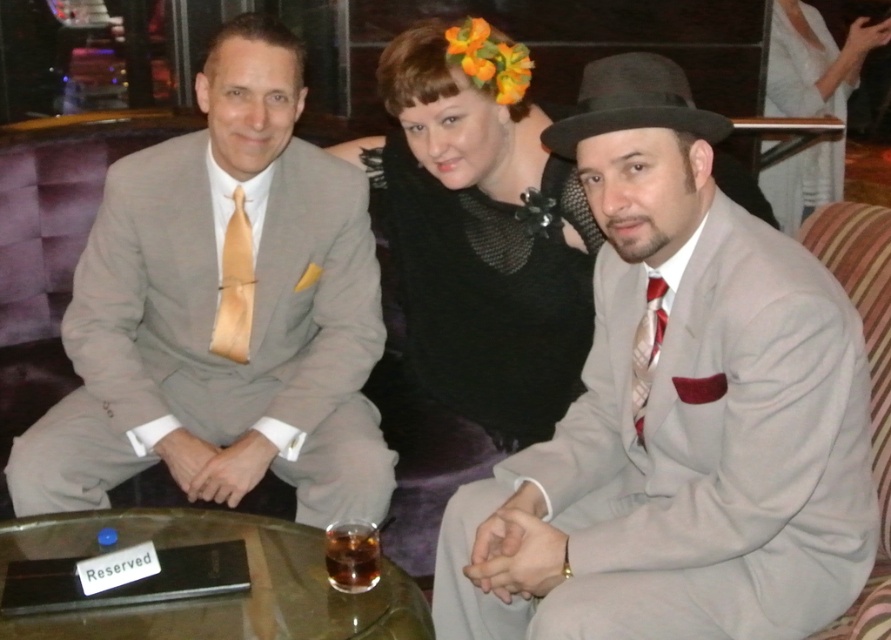
Question: Is matte gray suit at left smaller than translucent glass at center?

Choices:
 (A) no
 (B) yes

Answer: (A)

Question: Considering the relative positions of matte gray suit at left and black mesh dress at center in the image provided, where is matte gray suit at left located with respect to black mesh dress at center?

Choices:
 (A) below
 (B) above

Answer: (B)

Question: Which object appears farthest from the camera in this image?

Choices:
 (A) matte gray suit at left
 (B) translucent glass at center
 (C) satin gold tie at left

Answer: (C)

Question: Which object appears closest to the camera in this image?

Choices:
 (A) matte gray suit at left
 (B) white satin dress at upper right
 (C) white striped tie at right

Answer: (C)

Question: Is matte gray suit at left thinner than black mesh dress at center?

Choices:
 (A) yes
 (B) no

Answer: (B)

Question: Which is nearer to the black mesh dress at center?

Choices:
 (A) satin gold tie at left
 (B) white striped tie at right
 (C) white satin dress at upper right
 (D) translucent glass at center

Answer: (A)